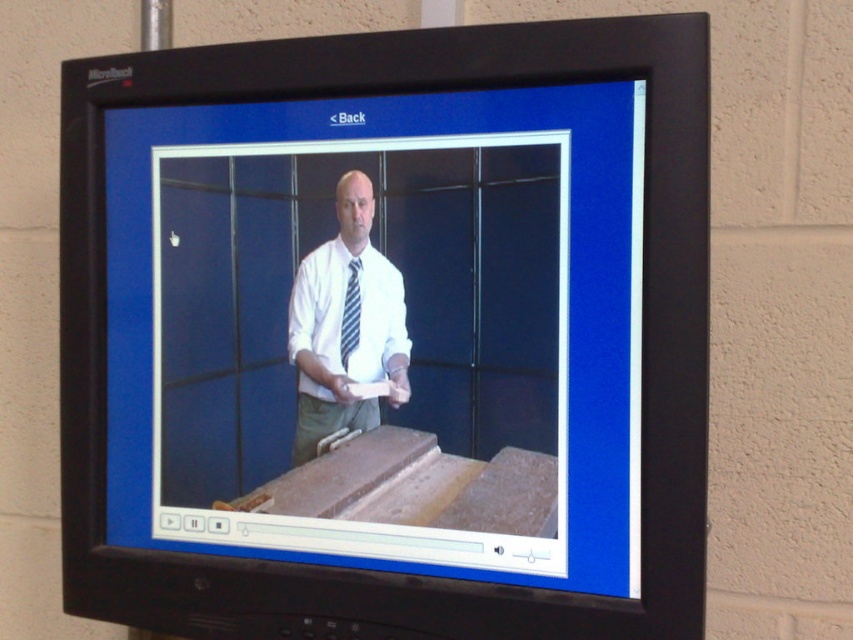
You are watching a paused video on a CRT television. In the video, you see a man wearing a white glossy shirt at center and a striped fabric tie at center. Which clothing item takes up more space in the video frame?

The white glossy shirt at center is bigger than the striped fabric tie at center, so the white glossy shirt at center takes up more space in the video frame.

You are watching a paused video on a CRT television screen. In the video, a man is wearing a white glossy shirt at center and a striped fabric tie at center. From your perspective watching the video, which clothing item is closer to you?

The white glossy shirt at center is in front of the striped fabric tie at center, so the white glossy shirt at center is closer to you.

You are watching a paused video on a CRT television. In the video, there is a man wearing a white glossy shirt at center and a striped fabric tie at center. Which clothing item is located lower on his body?

The white glossy shirt at center is positioned under the striped fabric tie at center, so the shirt is lower on his body than the tie.